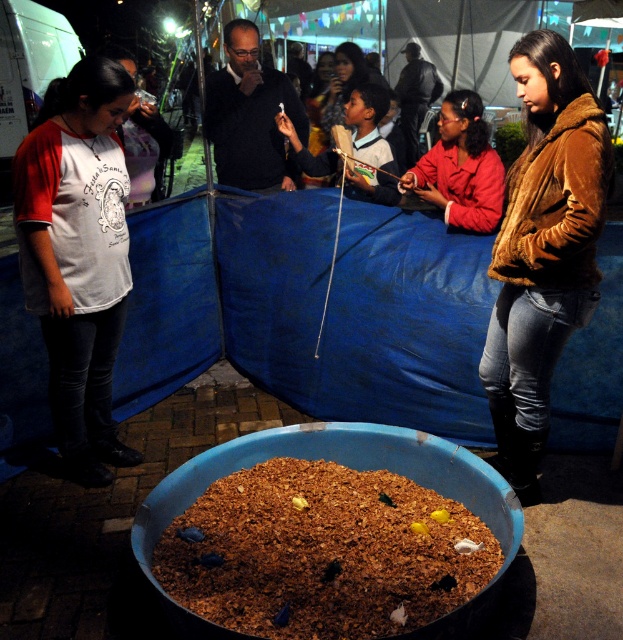
Question: Which of the following is the farthest from the observer?

Choices:
 (A) brown fuzzy jacket at lower right
 (B) white jersey at left
 (C) brown crumbly food at center

Answer: (B)

Question: Can you confirm if brown crumbly food at center is bigger than brown fuzzy jacket at lower right?

Choices:
 (A) yes
 (B) no

Answer: (B)

Question: Which point is closer to the camera taking this photo?

Choices:
 (A) (354, 44)
 (B) (82, 232)
 (C) (267, 600)
 (D) (551, 305)

Answer: (C)

Question: Does brown crumbly food at center come behind matte brown jacket at center?

Choices:
 (A) yes
 (B) no

Answer: (B)

Question: Does brown crumbly food at center have a smaller size compared to matte brown jacket at center?

Choices:
 (A) yes
 (B) no

Answer: (A)

Question: Which object is closer to the camera taking this photo?

Choices:
 (A) brown crumbly food at center
 (B) brown fuzzy jacket at lower right

Answer: (A)